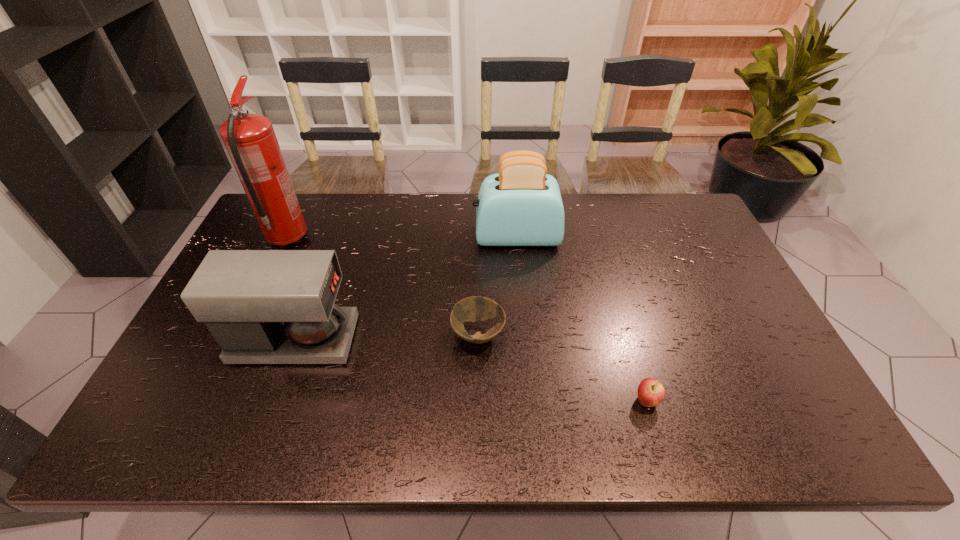
The image size is (960, 540). Find the location of `free point located on the side of the fourth shortest object with the lever`. free point located on the side of the fourth shortest object with the lever is located at coordinates (373, 237).

What are the coordinates of `vacant space situated 0.140m on the side of the fourth shortest object with the lever` in the screenshot? It's located at (431, 237).

I want to click on vacant space located 0.220m on the carafe side of the third shortest object, so (x=437, y=340).

The image size is (960, 540). I want to click on free spot located on the back of the apple, so click(613, 289).

What are the coordinates of `vacant space situated on the back of the bowl` in the screenshot? It's located at (478, 245).

I want to click on fire extinguisher that is at the far edge, so click(x=250, y=140).

This screenshot has width=960, height=540. In order to click on toaster located in the far edge section of the desktop in this screenshot , I will do `click(521, 205)`.

Identify the location of object that is at the near edge. (x=651, y=392).

The image size is (960, 540). Find the location of `fire extinguisher that is positioned at the left edge`. fire extinguisher that is positioned at the left edge is located at coordinates (250, 140).

Identify the location of coffee maker that is at the left edge. The width and height of the screenshot is (960, 540). (262, 306).